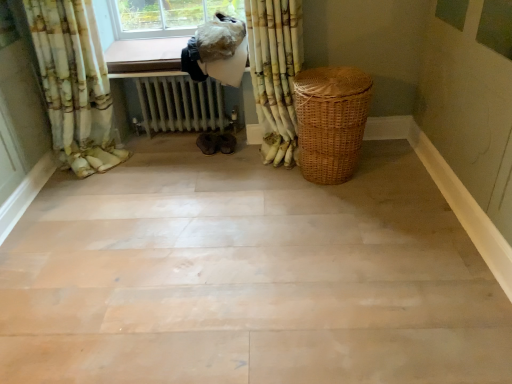
Question: Can we say white textured curtain at upper right, placed as the 1th curtain when sorted from right to left, lies outside woven brown basket at right?

Choices:
 (A) no
 (B) yes

Answer: (B)

Question: Considering the relative positions of white textured curtain at upper right, the second curtain in the left-to-right sequence, and woven brown basket at right in the image provided, is white textured curtain at upper right, the second curtain in the left-to-right sequence, to the right of woven brown basket at right from the viewer's perspective?

Choices:
 (A) no
 (B) yes

Answer: (A)

Question: Is white textured curtain at upper right, placed as the 1th curtain when sorted from right to left, oriented towards woven brown basket at right?

Choices:
 (A) no
 (B) yes

Answer: (A)

Question: Is white textured curtain at upper right, the second curtain in the left-to-right sequence, wider than woven brown basket at right?

Choices:
 (A) yes
 (B) no

Answer: (B)

Question: Can you confirm if white textured curtain at upper right, placed as the 1th curtain when sorted from right to left, is taller than woven brown basket at right?

Choices:
 (A) no
 (B) yes

Answer: (B)

Question: From a real-world perspective, does white textured curtain at upper right, the second curtain in the left-to-right sequence, sit lower than woven brown basket at right?

Choices:
 (A) no
 (B) yes

Answer: (A)

Question: Is white metallic radiator at center thinner than white textured curtain at upper right, placed as the 1th curtain when sorted from right to left?

Choices:
 (A) no
 (B) yes

Answer: (A)

Question: Considering the relative sizes of white metallic radiator at center and white textured curtain at upper right, placed as the 1th curtain when sorted from right to left, in the image provided, is white metallic radiator at center bigger than white textured curtain at upper right, placed as the 1th curtain when sorted from right to left,?

Choices:
 (A) yes
 (B) no

Answer: (B)

Question: From a real-world perspective, is white metallic radiator at center positioned over white textured curtain at upper right, the second curtain in the left-to-right sequence, based on gravity?

Choices:
 (A) yes
 (B) no

Answer: (B)

Question: Does white metallic radiator at center have a smaller size compared to white textured curtain at upper right, the second curtain in the left-to-right sequence?

Choices:
 (A) no
 (B) yes

Answer: (B)

Question: Considering the relative positions of white metallic radiator at center and white textured curtain at upper right, the second curtain in the left-to-right sequence, in the image provided, is white metallic radiator at center to the right of white textured curtain at upper right, the second curtain in the left-to-right sequence, from the viewer's perspective?

Choices:
 (A) yes
 (B) no

Answer: (B)

Question: Does white metallic radiator at center have a greater height compared to white textured curtain at upper right, the second curtain in the left-to-right sequence?

Choices:
 (A) no
 (B) yes

Answer: (A)

Question: From the image's perspective, is wooden floor at center on top of woven brown basket at right?

Choices:
 (A) no
 (B) yes

Answer: (A)